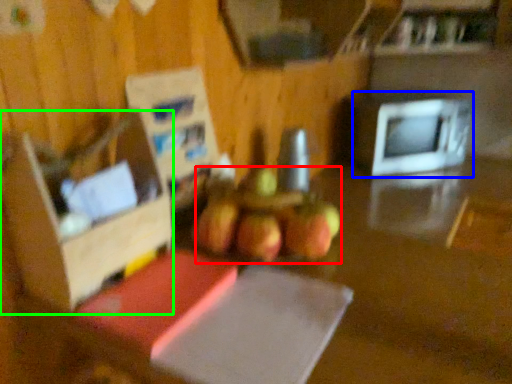
Question: Which object is positioned closest to apple (highlighted by a red box)? Select from microwave oven (highlighted by a blue box) and box (highlighted by a green box).

Choices:
 (A) microwave oven
 (B) box

Answer: (B)